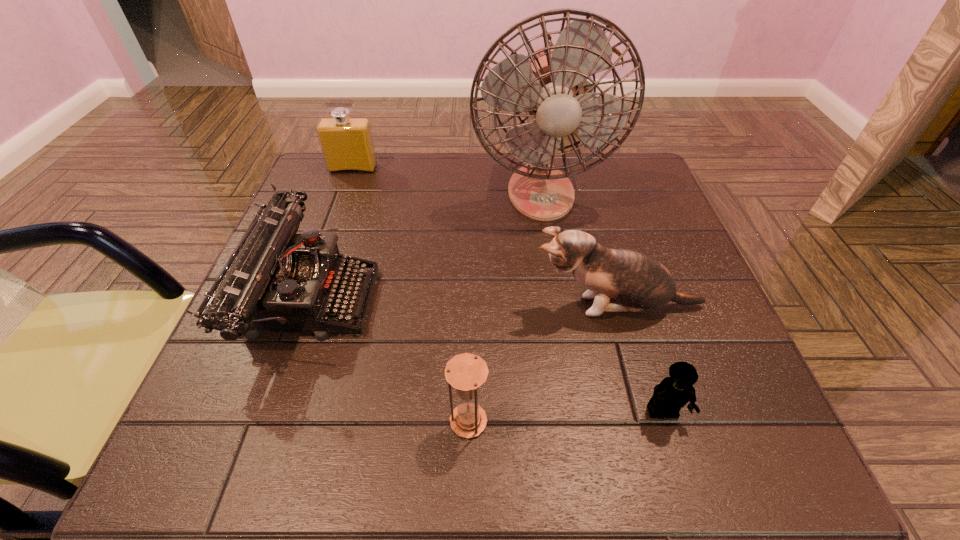
This screenshot has width=960, height=540. In order to click on fan in this screenshot , I will do `click(547, 83)`.

At what (x,y) coordinates should I click in order to perform the action: click on perfume. Please return your answer as a coordinate pair (x, y). The width and height of the screenshot is (960, 540). Looking at the image, I should click on (347, 145).

I want to click on cat, so click(639, 282).

Where is `typewriter`? typewriter is located at coordinates (278, 281).

Where is `hourglass`? The image size is (960, 540). hourglass is located at coordinates (466, 372).

Identify the location of the shortest object. This screenshot has height=540, width=960. (673, 392).

In order to click on vacant space located in front of the tallest object to direct airflow in this screenshot , I will do `click(568, 363)`.

Where is `free spot located 0.250m on the front-facing side of the perfume`? The width and height of the screenshot is (960, 540). free spot located 0.250m on the front-facing side of the perfume is located at coordinates (328, 237).

Identify the location of free space located 0.330m at the face of the cat. (357, 306).

At what (x,y) coordinates should I click in order to perform the action: click on vacant space located at the face of the cat. Please return your answer as a coordinate pair (x, y). Looking at the image, I should click on (410, 306).